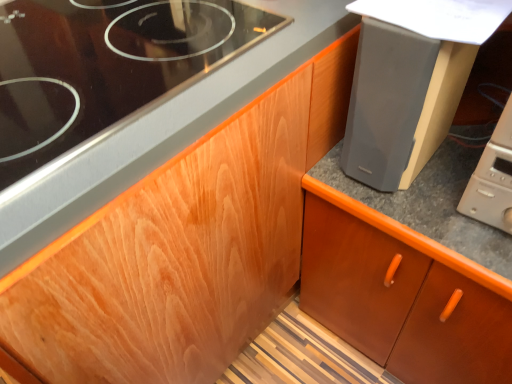
Question: Are black glass gas stove at upper left and matte gray speaker at upper right making contact?

Choices:
 (A) yes
 (B) no

Answer: (B)

Question: Is black glass gas stove at upper left closer to camera compared to matte gray speaker at upper right?

Choices:
 (A) no
 (B) yes

Answer: (B)

Question: Does black glass gas stove at upper left have a lesser height compared to matte gray speaker at upper right?

Choices:
 (A) no
 (B) yes

Answer: (B)

Question: Is black glass gas stove at upper left smaller than matte gray speaker at upper right?

Choices:
 (A) yes
 (B) no

Answer: (B)

Question: Does black glass gas stove at upper left have a greater height compared to matte gray speaker at upper right?

Choices:
 (A) yes
 (B) no

Answer: (B)

Question: From a real-world perspective, is brown wood cabinet at center physically located above or below black glass gas stove at upper left?

Choices:
 (A) above
 (B) below

Answer: (B)

Question: Is brown wood cabinet at center spatially inside black glass gas stove at upper left, or outside of it?

Choices:
 (A) inside
 (B) outside

Answer: (B)

Question: Is point (358, 289) closer or farther from the camera than point (143, 36)?

Choices:
 (A) closer
 (B) farther

Answer: (B)

Question: Considering the positions of brown wood cabinet at center and black glass gas stove at upper left in the image, is brown wood cabinet at center taller or shorter than black glass gas stove at upper left?

Choices:
 (A) tall
 (B) short

Answer: (A)

Question: Which is correct: matte gray speaker at upper right is inside black glass gas stove at upper left, or outside of it?

Choices:
 (A) inside
 (B) outside

Answer: (B)

Question: From the image's perspective, is matte gray speaker at upper right above or below black glass gas stove at upper left?

Choices:
 (A) above
 (B) below

Answer: (B)

Question: Relative to black glass gas stove at upper left, is matte gray speaker at upper right in front or behind?

Choices:
 (A) front
 (B) behind

Answer: (B)

Question: In terms of width, does matte gray speaker at upper right look wider or thinner when compared to black glass gas stove at upper left?

Choices:
 (A) wide
 (B) thin

Answer: (B)

Question: Considering the positions of black glass gas stove at upper left and brown wood cabinet at center in the image, is black glass gas stove at upper left wider or thinner than brown wood cabinet at center?

Choices:
 (A) wide
 (B) thin

Answer: (B)

Question: From a real-world perspective, is black glass gas stove at upper left above or below brown wood cabinet at center?

Choices:
 (A) below
 (B) above

Answer: (B)